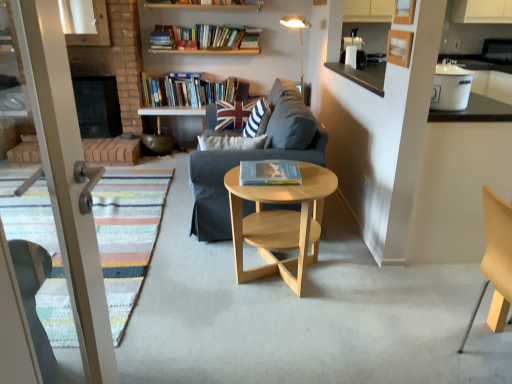
Question: Is hardcover book at center, which appears as the 2th book when viewed from the top, shorter than natural wood coffee table at center?

Choices:
 (A) no
 (B) yes

Answer: (B)

Question: Considering the relative sizes of hardcover book at center, arranged as the 1th book when ordered from the bottom, and natural wood coffee table at center in the image provided, is hardcover book at center, arranged as the 1th book when ordered from the bottom, smaller than natural wood coffee table at center?

Choices:
 (A) no
 (B) yes

Answer: (B)

Question: From a real-world perspective, is hardcover book at center, arranged as the 1th book when ordered from the bottom, beneath natural wood coffee table at center?

Choices:
 (A) yes
 (B) no

Answer: (B)

Question: Is hardcover book at center, which is counted as the first book, starting from the right, taller than natural wood coffee table at center?

Choices:
 (A) no
 (B) yes

Answer: (A)

Question: Is hardcover book at center, which ranks as the second book in left-to-right order, to the left of natural wood coffee table at center from the viewer's perspective?

Choices:
 (A) no
 (B) yes

Answer: (B)

Question: From the image's perspective, is white striped fabric pillow at center, which is the 2th pillow in back-to-front order, located above or below hardcover books at upper center, which ranks as the 2th book in right-to-left order?

Choices:
 (A) below
 (B) above

Answer: (A)

Question: In terms of width, does white striped fabric pillow at center, marked as the first pillow in a front-to-back arrangement, look wider or thinner when compared to hardcover books at upper center, which is counted as the first book, starting from the left?

Choices:
 (A) wide
 (B) thin

Answer: (B)

Question: In terms of height, does white striped fabric pillow at center, which is the 2th pillow in back-to-front order, look taller or shorter compared to hardcover books at upper center, arranged as the first book when viewed from the back?

Choices:
 (A) tall
 (B) short

Answer: (A)

Question: Do you think white striped fabric pillow at center, which is the 2th pillow in back-to-front order, is within hardcover books at upper center, arranged as the first book when viewed from the back, or outside of it?

Choices:
 (A) outside
 (B) inside

Answer: (A)

Question: From the image's perspective, is white striped fabric pillow at center, which is the 2th pillow in back-to-front order, located above or below dark gray fabric couch at center?

Choices:
 (A) above
 (B) below

Answer: (A)

Question: Is point (262, 112) positioned closer to the camera than point (297, 205)?

Choices:
 (A) closer
 (B) farther

Answer: (B)

Question: Based on their sizes in the image, would you say white striped fabric pillow at center, marked as the first pillow in a front-to-back arrangement, is bigger or smaller than dark gray fabric couch at center?

Choices:
 (A) small
 (B) big

Answer: (A)

Question: From a real-world perspective, is white striped fabric pillow at center, marked as the first pillow in a front-to-back arrangement, positioned above or below dark gray fabric couch at center?

Choices:
 (A) below
 (B) above

Answer: (B)

Question: In terms of height, does white striped fabric pillow at center, marked as the first pillow in a front-to-back arrangement, look taller or shorter compared to union jack fabric pillow at center, the 2th pillow in the front-to-back sequence?

Choices:
 (A) short
 (B) tall

Answer: (B)

Question: Is white striped fabric pillow at center, which is the 2th pillow in back-to-front order, to the left or to the right of union jack fabric pillow at center, the 2th pillow in the front-to-back sequence, in the image?

Choices:
 (A) right
 (B) left

Answer: (A)